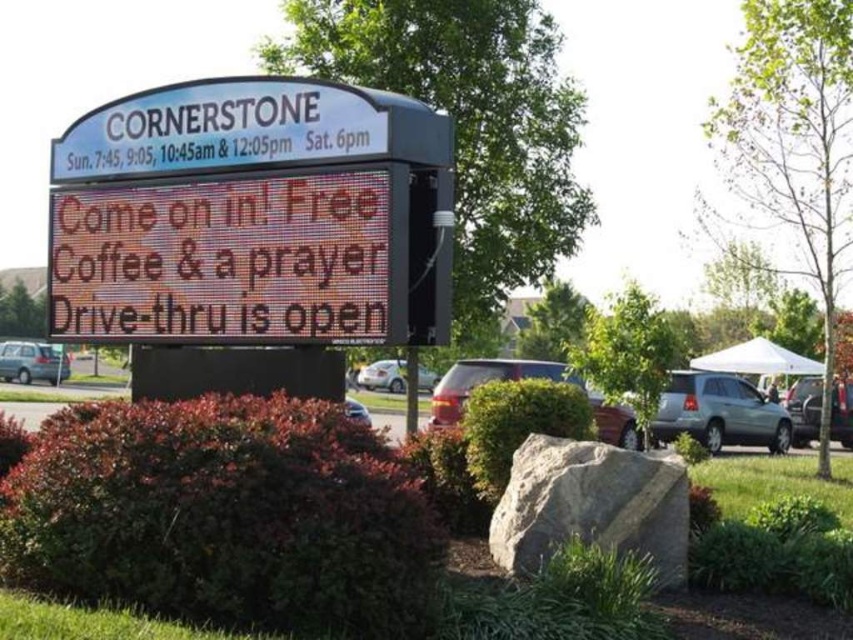
Question: Can you confirm if silver metallic sedan at lower left is wider than silver metallic car at center?

Choices:
 (A) no
 (B) yes

Answer: (B)

Question: Does white digital sign at center lie behind silver metallic suv at right?

Choices:
 (A) no
 (B) yes

Answer: (A)

Question: Which of the following is the closest to the observer?

Choices:
 (A) silver metallic car at center
 (B) silver metallic sedan at lower left
 (C) matte red suv at center

Answer: (C)

Question: Among these objects, which one is farthest from the camera?

Choices:
 (A) matte red suv at center
 (B) silver metallic car at center
 (C) white digital sign at center
 (D) silver metallic suv at center

Answer: (B)

Question: Which object is the farthest from the white digital sign at center?

Choices:
 (A) silver metallic suv at right
 (B) silver metallic sedan at lower left
 (C) matte red suv at center

Answer: (B)

Question: Does green shrubbery at center appear on the left side of silver metallic car at center?

Choices:
 (A) no
 (B) yes

Answer: (B)